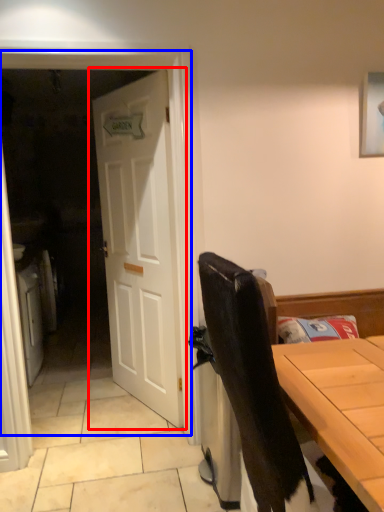
Question: Which point is further to the camera, door (highlighted by a red box) or screen door (highlighted by a blue box)?

Choices:
 (A) door
 (B) screen door

Answer: (A)